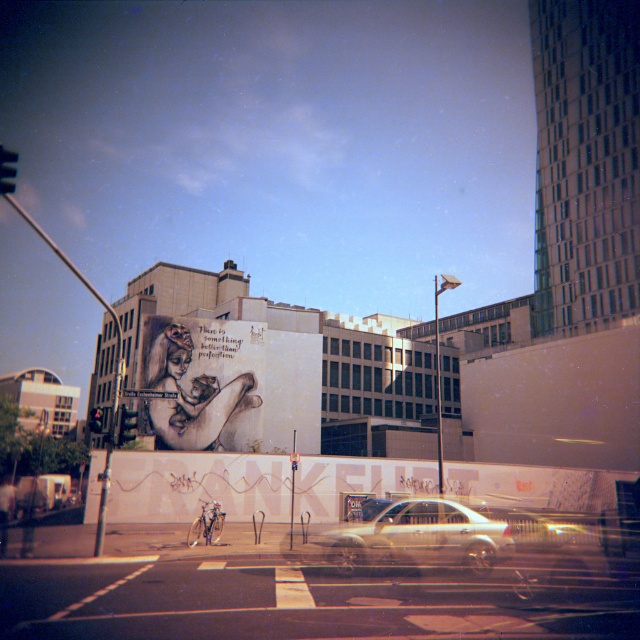
Is the position of matte white mural at center less distant than that of metallic silver sedan at center?

No.

Can you confirm if matte white mural at center is positioned to the left of metallic silver sedan at center?

Yes, matte white mural at center is to the left of metallic silver sedan at center.

The width and height of the screenshot is (640, 640). Describe the element at coordinates (230, 385) in the screenshot. I see `matte white mural at center` at that location.

The height and width of the screenshot is (640, 640). I want to click on matte white mural at center, so click(230, 385).